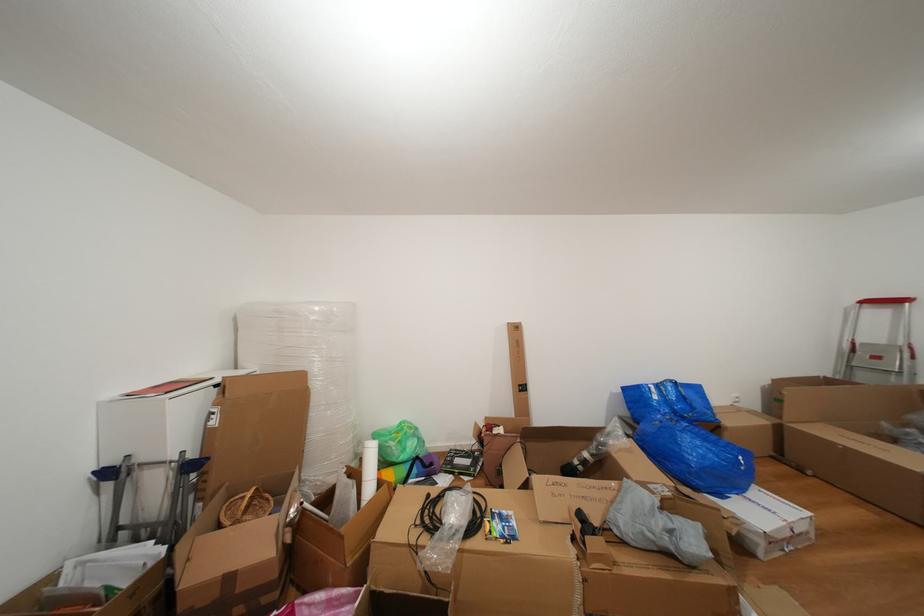
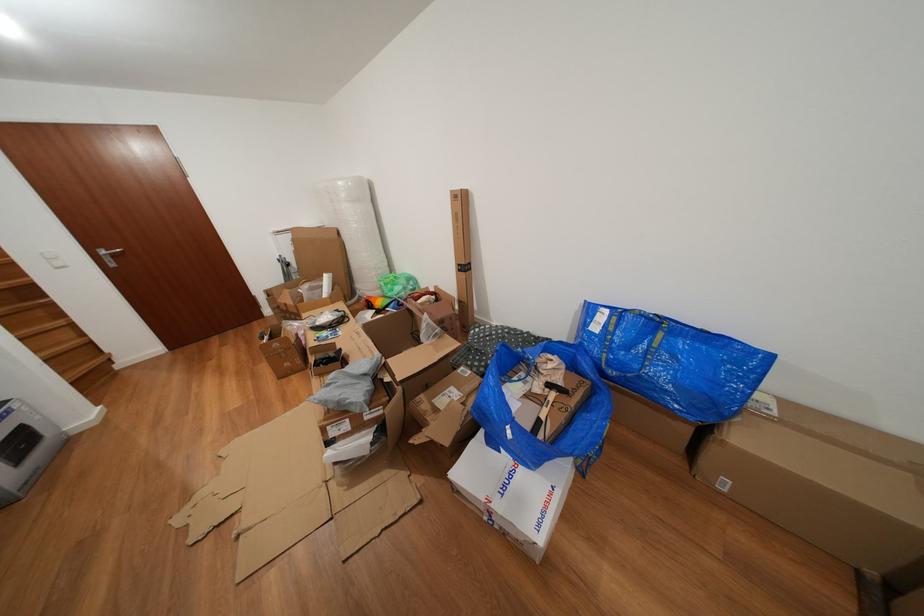
Locate, in the second image, the point that corresponds to (x=422, y=476) in the first image.

(399, 310)